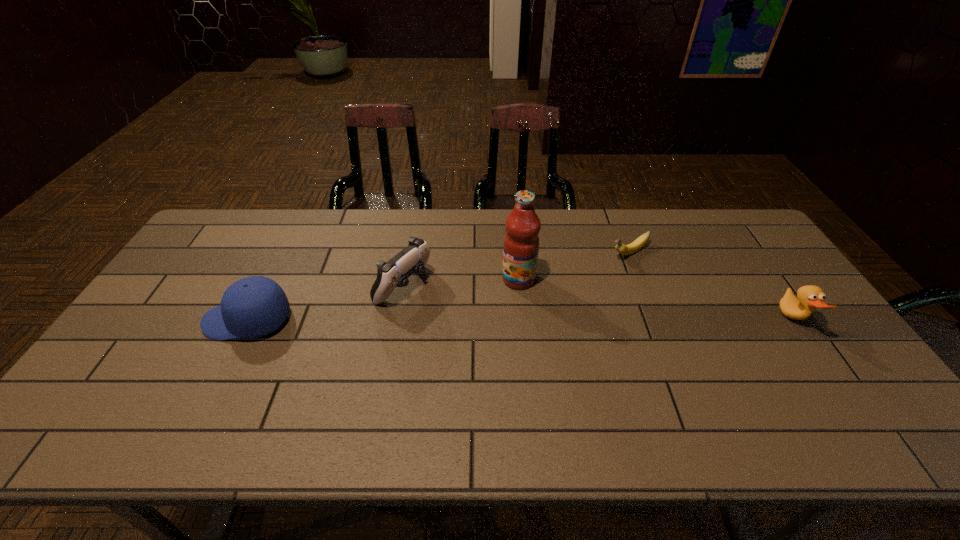
This screenshot has height=540, width=960. In order to click on the leftmost object in this screenshot , I will do `click(255, 306)`.

Find the location of a particular element. The height and width of the screenshot is (540, 960). the rightmost object is located at coordinates (810, 297).

At what (x,y) coordinates should I click in order to perform the action: click on the second object from left to right. Please return your answer as a coordinate pair (x, y). This screenshot has width=960, height=540. Looking at the image, I should click on (411, 260).

At what (x,y) coordinates should I click in order to perform the action: click on banana. Please return your answer as a coordinate pair (x, y). Looking at the image, I should click on pos(636,245).

This screenshot has width=960, height=540. Identify the location of the second object from right to left. (636, 245).

At what (x,y) coordinates should I click in order to perform the action: click on the tallest object. Please return your answer as a coordinate pair (x, y). The width and height of the screenshot is (960, 540). Looking at the image, I should click on (521, 243).

Find the location of a particular element. fruit juice is located at coordinates (521, 243).

Image resolution: width=960 pixels, height=540 pixels. Find the location of `vacant point located 0.090m on the front-facing side of the cap`. vacant point located 0.090m on the front-facing side of the cap is located at coordinates (172, 320).

In order to click on free space located 0.080m on the front-facing side of the cap in this screenshot , I will do `click(176, 320)`.

Identify the location of free space located on the front-facing side of the cap. This screenshot has width=960, height=540. (x=182, y=320).